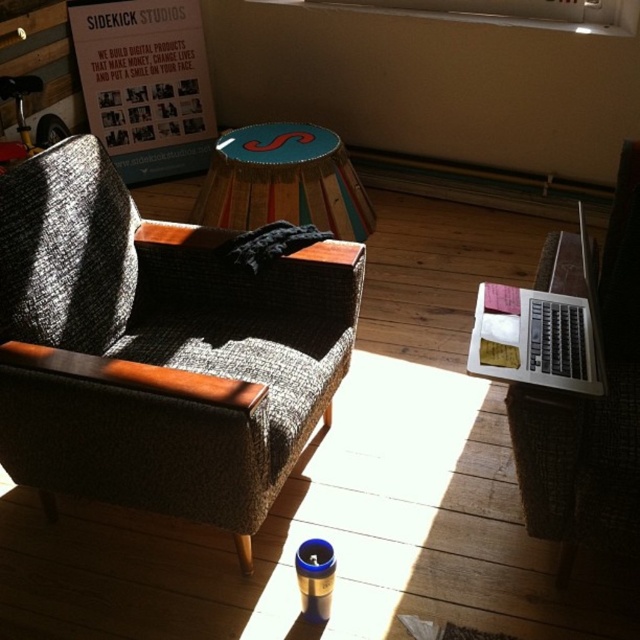
Question: Is textured gray couch at left to the left of wooden stool at center from the viewer's perspective?

Choices:
 (A) no
 (B) yes

Answer: (B)

Question: Is textured gray couch at left thinner than wooden stool at center?

Choices:
 (A) yes
 (B) no

Answer: (B)

Question: Which point is farther from the camera taking this photo?

Choices:
 (A) (232, 200)
 (B) (26, 234)

Answer: (A)

Question: Does textured gray couch at left have a lesser width compared to wooden stool at center?

Choices:
 (A) yes
 (B) no

Answer: (B)

Question: Which of the following is the closest to the observer?

Choices:
 (A) wooden stool at center
 (B) textured gray couch at left

Answer: (B)

Question: Among these objects, which one is nearest to the camera?

Choices:
 (A) textured gray couch at left
 (B) wooden stool at center

Answer: (A)